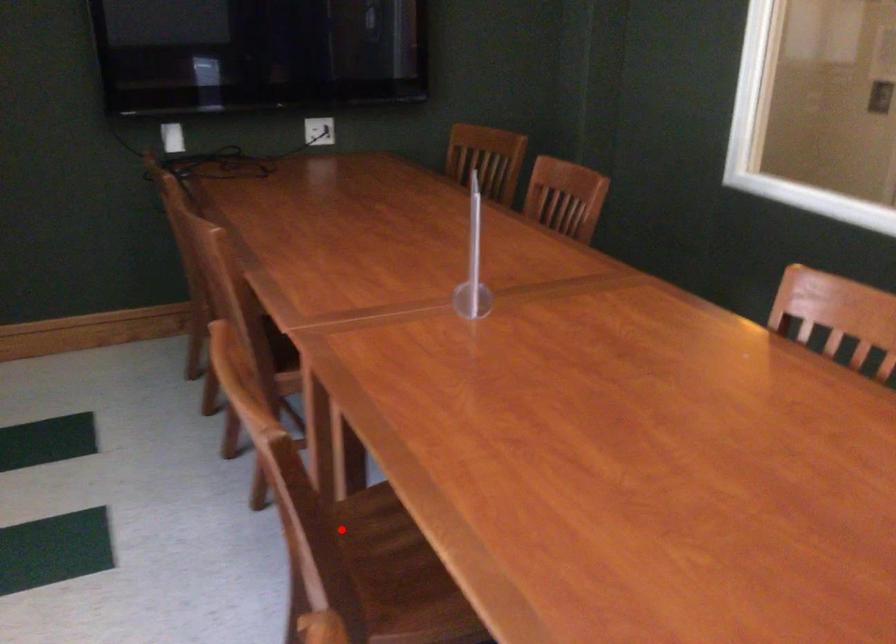
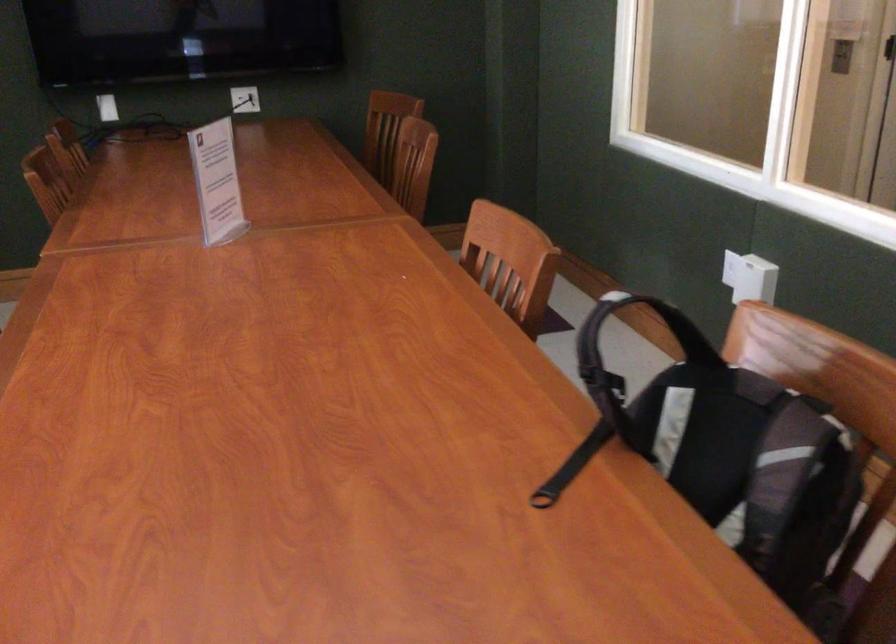
Question: I am providing you with two images of the same scene from different viewpoints. A red point is marked on the first image. Can you still see the location of the red point in image 2?

Choices:
 (A) Yes
 (B) No

Answer: (B)